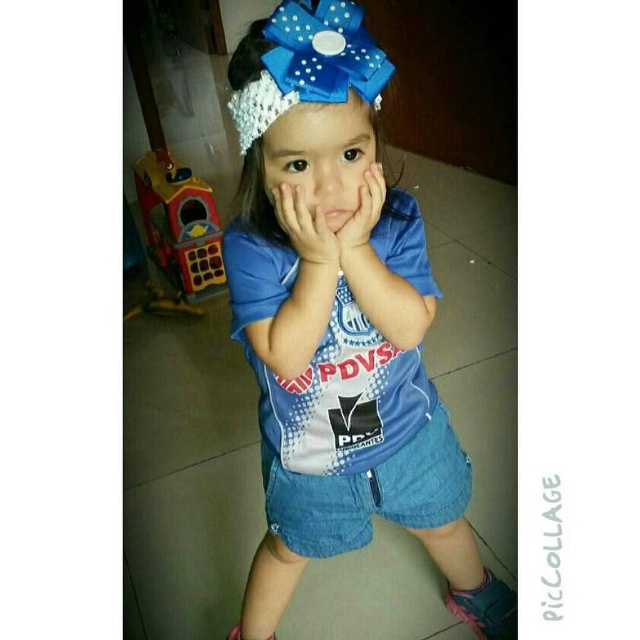
Between point (164, 209) and point (321, 237), which one is positioned behind?

The point (164, 209) is behind.

Image resolution: width=640 pixels, height=640 pixels. In order to click on matte plastic toy at left in this screenshot , I will do `click(177, 232)`.

Does blue denim shorts at center appear under matte blue hand at center?

Indeed, blue denim shorts at center is positioned under matte blue hand at center.

Can you confirm if blue denim shorts at center is thinner than matte blue hand at center?

No, blue denim shorts at center is not thinner than matte blue hand at center.

Between point (323, 285) and point (356, 234), which one is positioned behind?

The point (323, 285) is more distant.

Locate an element on the screen. blue denim shorts at center is located at coordinates (339, 326).

Does blue satin bow at upper center appear on the left side of matte blue hands at center?

Incorrect, blue satin bow at upper center is not on the left side of matte blue hands at center.

Can you confirm if blue satin bow at upper center is positioned below matte blue hands at center?

No, blue satin bow at upper center is not below matte blue hands at center.

Is point (362, 22) behind point (328, 253)?

No, (362, 22) is in front of (328, 253).

At what (x,y) coordinates should I click in order to perform the action: click on blue satin bow at upper center. Please return your answer as a coordinate pair (x, y). Looking at the image, I should click on (308, 65).